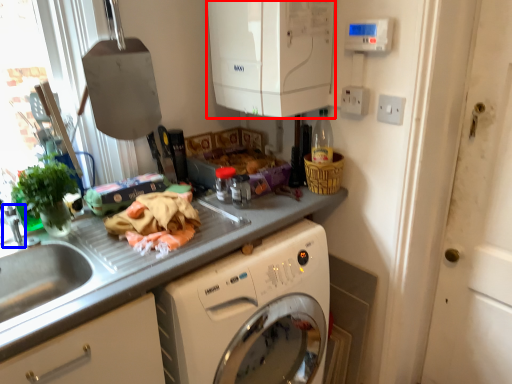
Question: Among these objects, which one is farthest to the camera, appliance (highlighted by a red box) or faucet (highlighted by a blue box)?

Choices:
 (A) appliance
 (B) faucet

Answer: (B)